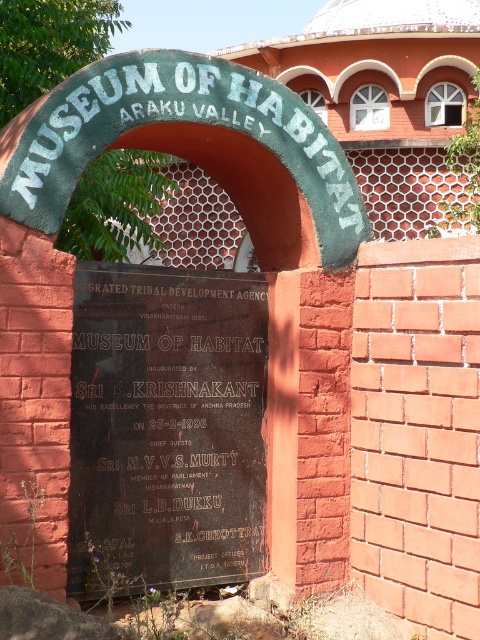
You are a tour guide at the Museum of Habitat in Araku Valley. You need to inform visitors about the two main entrance markers. Which one is larger in size between the green painted metal signboard at center and the black polished stone plaque at center?

The green painted metal signboard at center is bigger than the black polished stone plaque at center.

You are standing at the entrance of the Museum of Habitat. You see a green painted metal signboard at center and a black polished stone plaque at center. Which one is positioned to the left?

The green painted metal signboard at center is to the left of the black polished stone plaque at center.